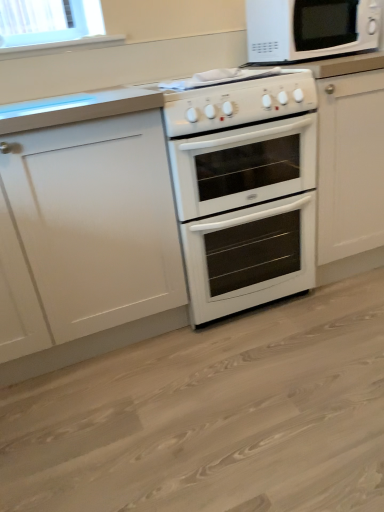
What is the approximate height of white glossy oven at center?

The height of white glossy oven at center is 30.07 inches.

Measure the distance between white glossy oven at center and camera.

They are 38.52 inches apart.

Identify the location of white matte cabinet at left. (86, 230).

Image resolution: width=384 pixels, height=512 pixels. I want to click on white glossy oven at center, so click(x=246, y=214).

Choose the correct answer: Is white matte cabinet at left inside white glossy gas stove at center or outside it?

white matte cabinet at left is located beyond the bounds of white glossy gas stove at center.

How many degrees apart are the facing directions of white matte cabinet at left and white glossy gas stove at center?

They differ by 0.000851 degrees in their facing directions.

Is white matte cabinet at left closer to camera compared to white glossy gas stove at center?

Yes, the depth of white matte cabinet at left is less than that of white glossy gas stove at center.

Considering the sizes of white glossy oven at center and white matte cabinet at left in the image, is white glossy oven at center wider or thinner than white matte cabinet at left?

Considering their sizes, white glossy oven at center looks broader than white matte cabinet at left.

Is point (378, 478) in front of point (125, 133)?

Yes, point (378, 478) is in front of point (125, 133).

Does white glossy oven at center have a larger size compared to white matte cabinet at left?

Actually, white glossy oven at center might be smaller than white matte cabinet at left.

Is white glossy oven at center oriented away from white matte cabinet at left?

white glossy oven at center is not turned away from white matte cabinet at left.

Between white glossy gas stove at center and white glossy oven at center, which one has smaller width?

Thinner between the two is white glossy gas stove at center.

Considering the sizes of objects white glossy gas stove at center and white glossy oven at center in the image provided, who is taller, white glossy gas stove at center or white glossy oven at center?

Standing taller between the two is white glossy oven at center.

From a real-world perspective, is white glossy gas stove at center physically located above or below white glossy oven at center?

white glossy gas stove at center is above white glossy oven at center.

In terms of width, does white glossy microwave at upper right look wider or thinner when compared to white glossy oven at center?

white glossy microwave at upper right is thinner than white glossy oven at center.

From the image's perspective, relative to white glossy oven at center, is white glossy microwave at upper right above or below?

Based on their image positions, white glossy microwave at upper right is located above white glossy oven at center.

Which of these two, white glossy microwave at upper right or white glossy oven at center, stands shorter?

white glossy microwave at upper right is shorter.

From a real-world perspective, relative to white matte cabinet at left, is white glossy microwave at upper right vertically above or below?

In terms of real-world spatial position, white glossy microwave at upper right is above white matte cabinet at left.

From the image's perspective, is white glossy microwave at upper right below white matte cabinet at left?

Actually, white glossy microwave at upper right appears above white matte cabinet at left in the image.

Does white glossy microwave at upper right have a smaller size compared to white matte cabinet at left?

Correct, white glossy microwave at upper right occupies less space than white matte cabinet at left.

Is the depth of white glossy microwave at upper right greater than that of white matte cabinet at left?

Yes, white glossy microwave at upper right is further from the camera.

From a real-world perspective, who is located lower, white glossy oven at center or white matte cabinet at left?

white glossy oven at center is physically lower.

Image resolution: width=384 pixels, height=512 pixels. I want to click on oven behind the white matte cabinet at left, so click(246, 214).

Does point (223, 156) appear closer or farther from the camera than point (180, 276)?

Point (223, 156).

Considering the relative positions of white glossy oven at center and white matte cabinet at left in the image provided, is white glossy oven at center to the left or to the right of white matte cabinet at left?

Based on their positions, white glossy oven at center is located to the right of white matte cabinet at left.

Is white glossy microwave at upper right at the back of white glossy oven at center?

No, white glossy oven at center's orientation is not away from white glossy microwave at upper right.

Is white glossy oven at center with white glossy microwave at upper right?

No, white glossy oven at center is not next to white glossy microwave at upper right.

Is white glossy oven at center to the left or to the right of white glossy microwave at upper right in the image?

In the image, white glossy oven at center appears on the left side of white glossy microwave at upper right.

The height and width of the screenshot is (512, 384). What are the coordinates of `cabinetry to the left of white glossy gas stove at center` in the screenshot? It's located at (86, 230).

You are a GUI agent. You are given a task and a screenshot of the screen. Output one action in this format:
    pyautogui.click(x=<x>, y=<y>)
    Task: Click on the plain on the right of white matte cabinet at left
    The height and width of the screenshot is (512, 384).
    Given the screenshot: What is the action you would take?
    pyautogui.click(x=213, y=416)

Which object lies further to the anchor point white matte cabinet at left, white glossy microwave at upper right or white glossy oven at center?

white glossy microwave at upper right is further to white matte cabinet at left.

Consider the image. Looking at the image, which one is located closer to white glossy oven at center, white matte cabinet at left or white glossy oven at center?

Among the two, white matte cabinet at left is located nearer to white glossy oven at center.

When comparing their distances from white glossy oven at center, does white glossy microwave at upper right or white glossy gas stove at center seem closer?

Among the two, white glossy gas stove at center is located nearer to white glossy oven at center.

Considering their positions, is white matte cabinet at left positioned further to white glossy microwave at upper right than white glossy oven at center?

white matte cabinet at left lies further to white glossy microwave at upper right than the other object.

Which object lies further to the anchor point white glossy microwave at upper right, white glossy gas stove at center or white matte cabinet at left?

The object further to white glossy microwave at upper right is white matte cabinet at left.

Considering their positions, is white glossy microwave at upper right positioned closer to white glossy oven at center than white matte cabinet at left?

Based on the image, white matte cabinet at left appears to be nearer to white glossy oven at center.

Looking at the image, which one is located further to white matte cabinet at left, white glossy oven at center or white glossy microwave at upper right?

white glossy microwave at upper right is positioned further to the anchor white matte cabinet at left.

When comparing their distances from white matte cabinet at left, does white glossy oven at center or white glossy microwave at upper right seem closer?

Among the two, white glossy oven at center is located nearer to white matte cabinet at left.

At what (x,y) coordinates should I click in order to perform the action: click on gas stove that lies between white glossy microwave at upper right and white glossy oven at center from top to bottom. Please return your answer as a coordinate pair (x, y). Looking at the image, I should click on (237, 101).

Where is `gas stove situated between white matte cabinet at left and white glossy oven at center from left to right`? This screenshot has height=512, width=384. gas stove situated between white matte cabinet at left and white glossy oven at center from left to right is located at coordinates (237, 101).

Locate an element on the screen. The width and height of the screenshot is (384, 512). oven situated between white matte cabinet at left and white glossy microwave at upper right from left to right is located at coordinates click(246, 214).

The width and height of the screenshot is (384, 512). In order to click on gas stove between white glossy microwave at upper right and white glossy oven at center in the up-down direction in this screenshot , I will do `click(237, 101)`.